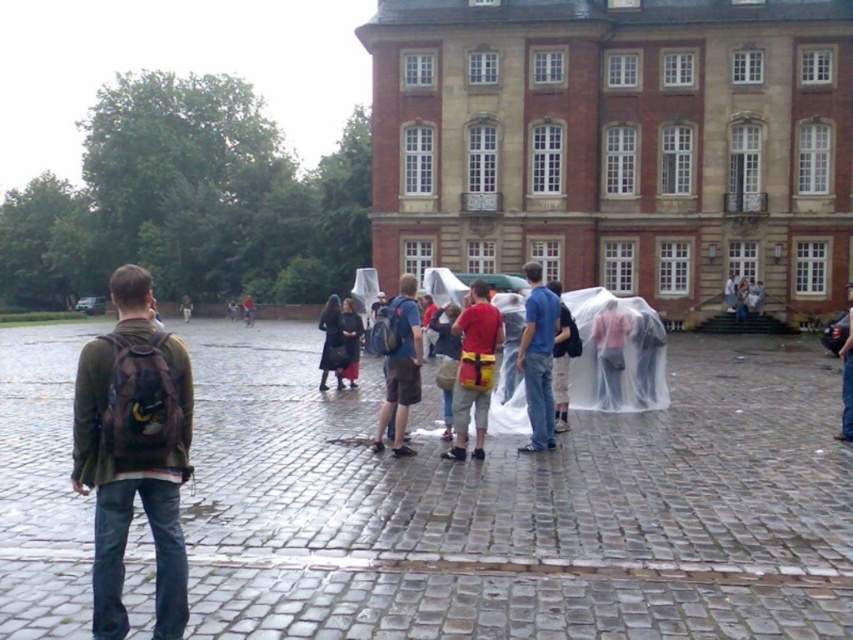
You are a delivery person who needs to place a package between the red fabric backpack at center and the dark gray fabric coat at center. The package requires 50 feet of space. Can you fit it there?

The distance between the red fabric backpack at center and the dark gray fabric coat at center is 55.23 feet, so yes, the package requiring 50 feet of space can fit between them.

You are standing at the point with coordinates (474, 369) in the image. What object is located exactly at that point?

The point at coordinates (474, 369) corresponds to the red fabric backpack at center.

You are a tour guide leading a group to a historic building. You have a blue backpack at center. The tour group is 45.94 meters away from you. Can you hand your backpack to the group without leaving your current position?

The tour group is 45.94 meters away from the blue backpack at center. Since the distance is too large, you cannot hand the backpack to the group without moving closer.